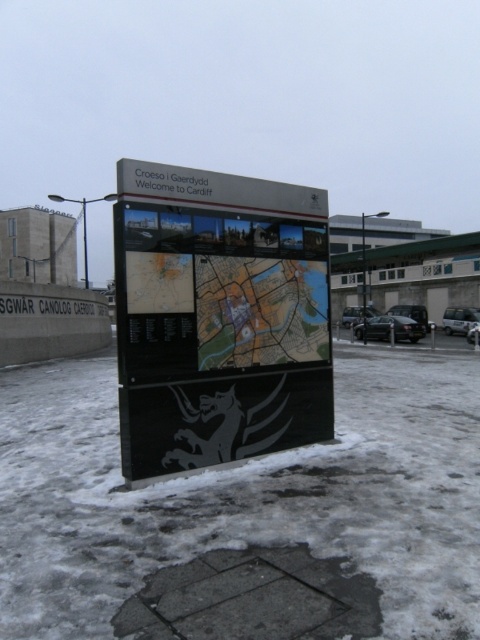
Question: Is matte black signboard at center thinner than black asphalt parking lot at lower right?

Choices:
 (A) no
 (B) yes

Answer: (B)

Question: Which point is closer to the camera taking this photo?

Choices:
 (A) (134, 298)
 (B) (266, 576)
 (C) (355, 316)

Answer: (B)

Question: Is white powdery snow at lower center thinner than black asphalt parking lot at lower right?

Choices:
 (A) no
 (B) yes

Answer: (A)

Question: Is white powdery snow at lower center closer to the viewer compared to matte black signboard at center?

Choices:
 (A) yes
 (B) no

Answer: (A)

Question: Which object is the closest to the matte black signboard at center?

Choices:
 (A) black asphalt parking lot at lower right
 (B) white powdery snow at lower center

Answer: (B)

Question: Which object appears closest to the camera in this image?

Choices:
 (A) black asphalt parking lot at lower right
 (B) white powdery snow at lower center

Answer: (B)